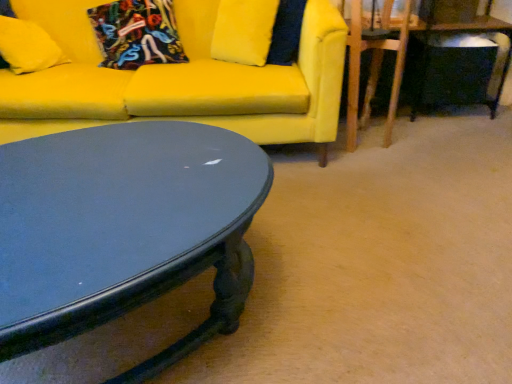
At what (x,y) coordinates should I click in order to perform the action: click on free space in front of wooden swivel chair at right. Please return your answer as a coordinate pair (x, y). This screenshot has height=384, width=512. Looking at the image, I should click on (370, 159).